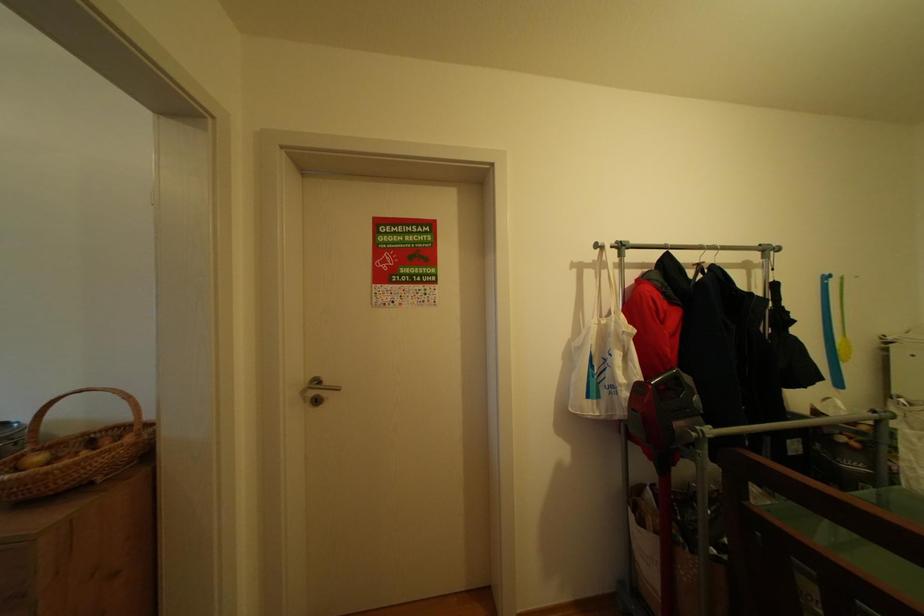
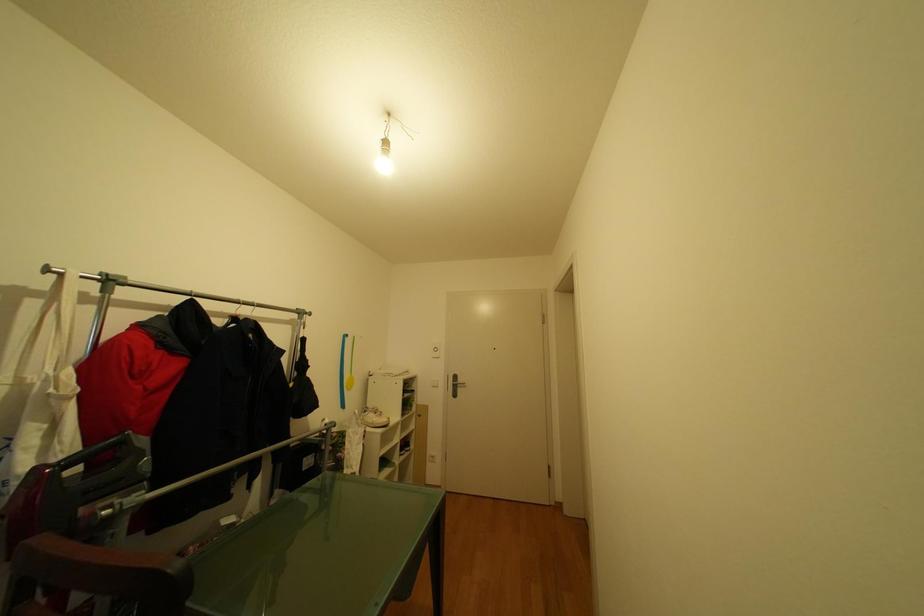
Question: The camera is either moving clockwise (left) or counter-clockwise (right) around the object. The first image is from the beginning of the video and the second image is from the end. Is the camera moving left or right when shooting the video?

Choices:
 (A) Left
 (B) Right

Answer: (A)